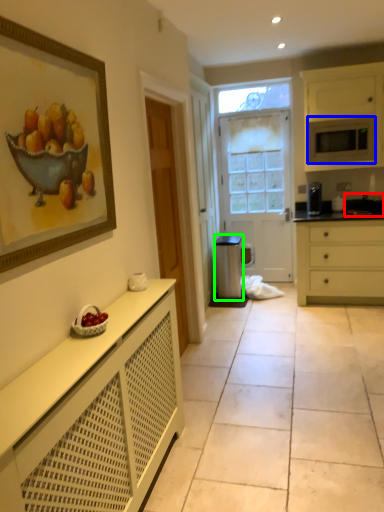
Question: Which is nearer to the sink (highlighted by a red box)? microwave oven (highlighted by a blue box) or appliance (highlighted by a green box).

Choices:
 (A) microwave oven
 (B) appliance

Answer: (A)